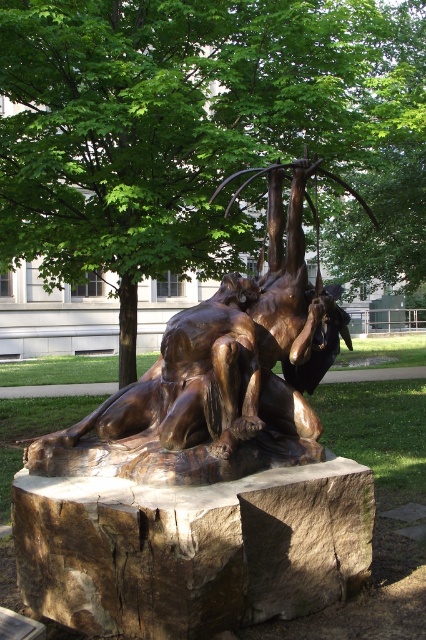
Question: Does brown rough stone at center have a lesser width compared to bronze sculpture at center?

Choices:
 (A) yes
 (B) no

Answer: (B)

Question: Is green leafy tree at upper center to the left of bronze statue at center from the viewer's perspective?

Choices:
 (A) no
 (B) yes

Answer: (A)

Question: Based on their relative distances, which object is nearer to the bronze statue at center?

Choices:
 (A) bronze sculpture at center
 (B) green leafy tree at upper center
 (C) brown rough stone at center

Answer: (A)

Question: Among these objects, which one is farthest from the camera?

Choices:
 (A) bronze statue at center
 (B) bronze sculpture at center
 (C) green leafy tree at upper center
 (D) brown rough stone at center

Answer: (C)

Question: Which point is farther from the camera taking this photo?

Choices:
 (A) (155, 474)
 (B) (330, 173)

Answer: (B)

Question: Where is brown rough stone at center located in relation to bronze sculpture at center in the image?

Choices:
 (A) right
 (B) left

Answer: (B)